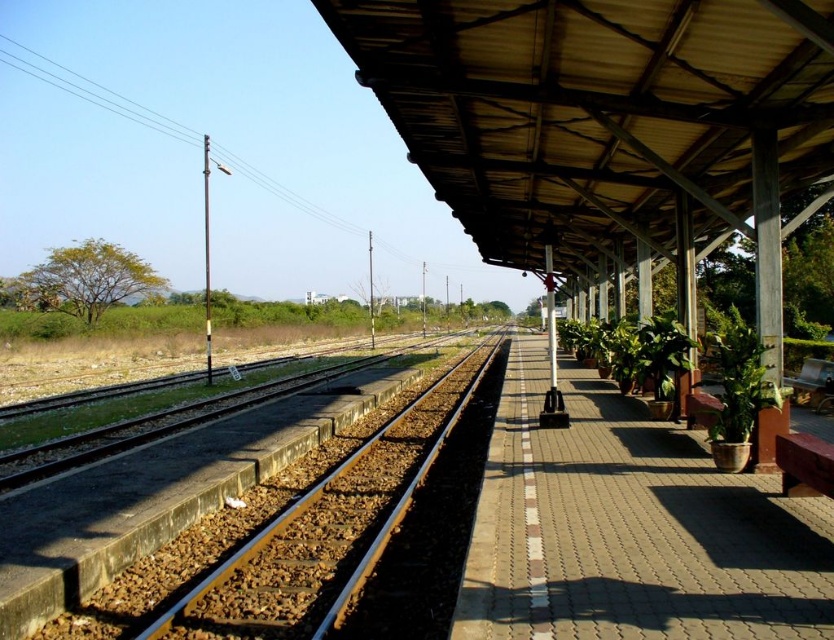
You are standing on the railway station platform and want to place a 4.5 meter long banner between you and the green leafy plants at center. Will the banner fit without overlapping the plants?

The green leafy plants at center is 4.15 meters away from viewer. The banner is 4.5 meters long, so it will extend beyond the plants by 0.35 meters, overlapping them.

You are a passenger waiting on the platform and want to walk from the green leafy plants at center to the metal at left. Which direction should you move?

To move from the green leafy plants at center to the metal at left, you should move to the left since the green leafy plants at center is located to the right of the metal at left.

You are a maintenance worker who needs to cross from the green leafy plants at center to the metal at left. The safety regulations state that the minimum safe distance for crossing is 3 meters. Can you safely cross between them?

The green leafy plants at center and metal at left are 2.92 meters apart, which is less than the required 3 meters for safe crossing. Therefore, you cannot safely cross between them.